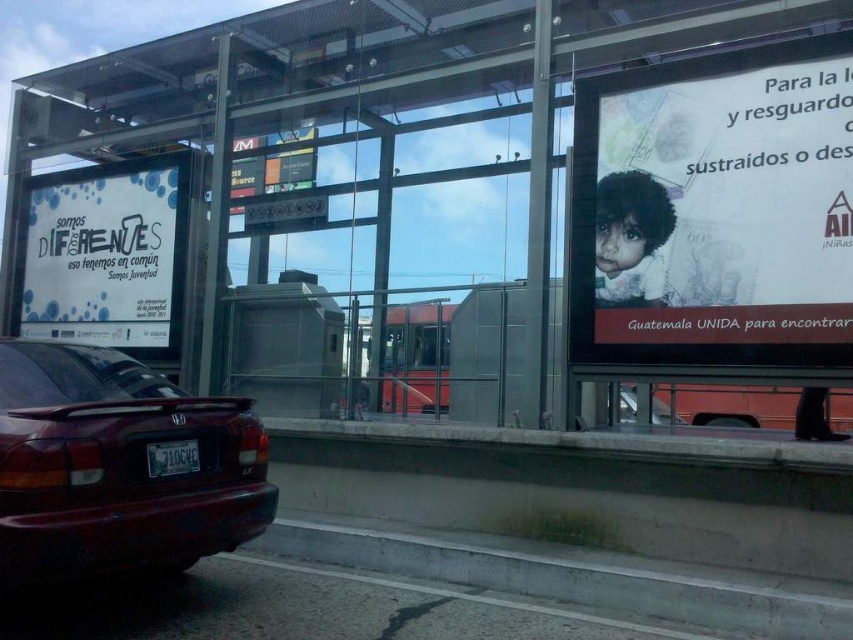
Looking at this image, based on the scene description, which object is larger in size between the white paper billboard at left and the metallic silver car at lower right?

→ The white paper billboard at left is bigger than the metallic silver car at lower right.

In the scene shown: You are a pedestrian standing at the bus stop and want to read the advertisement on the white paper billboard at left. Can you see the metallic silver car at lower right while looking at the billboard?

The white paper billboard at left is located above the metallic silver car at lower right, so yes, you can see the metallic silver car at lower right while looking at the billboard.

What is the position of the white paper billboard at left in the image?

The white paper billboard at left is located at point (107, 253).